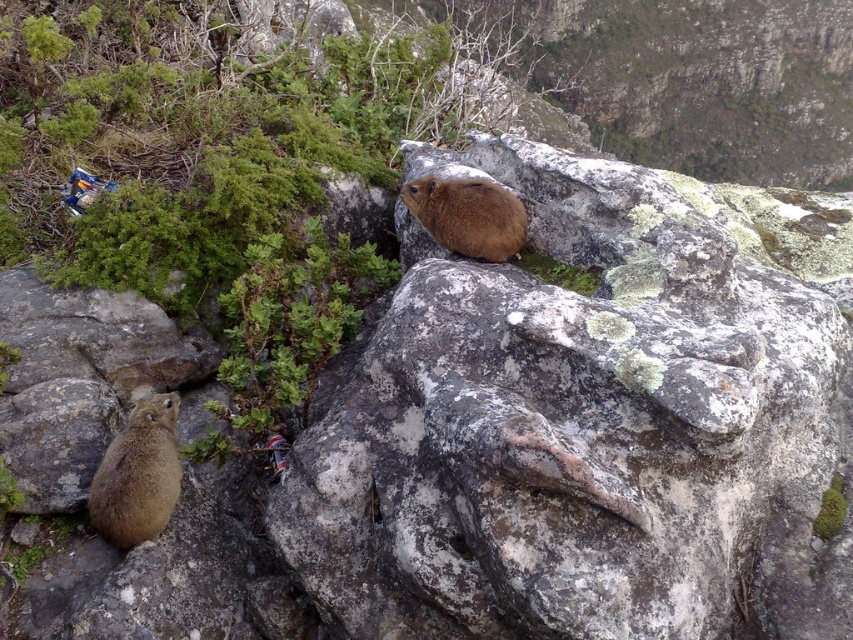
Question: Which object appears closest to the camera in this image?

Choices:
 (A) brown furry rock hyrax at center
 (B) brown furry squirrel at lower left

Answer: (B)

Question: Which of the following is the closest to the observer?

Choices:
 (A) (173, 442)
 (B) (456, 218)

Answer: (A)

Question: Does brown furry squirrel at lower left come behind brown furry rock hyrax at center?

Choices:
 (A) no
 (B) yes

Answer: (A)

Question: Which of the following is the farthest from the observer?

Choices:
 (A) (451, 216)
 (B) (144, 496)

Answer: (A)

Question: Considering the relative positions of brown furry squirrel at lower left and brown furry rock hyrax at center in the image provided, where is brown furry squirrel at lower left located with respect to brown furry rock hyrax at center?

Choices:
 (A) left
 (B) right

Answer: (A)

Question: Is the position of brown furry squirrel at lower left more distant than that of brown furry rock hyrax at center?

Choices:
 (A) yes
 (B) no

Answer: (B)